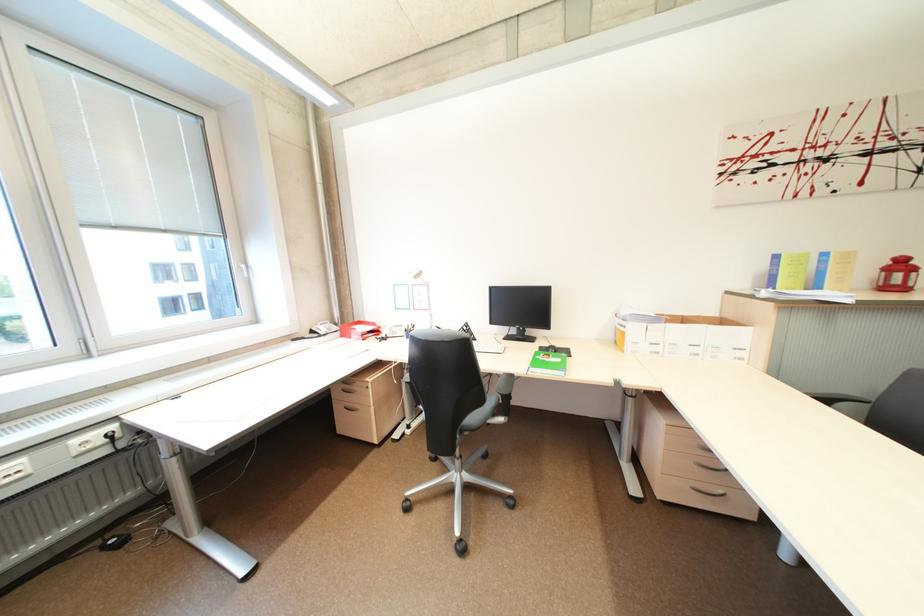
What do you see at coordinates (772, 270) in the screenshot?
I see `the blue book` at bounding box center [772, 270].